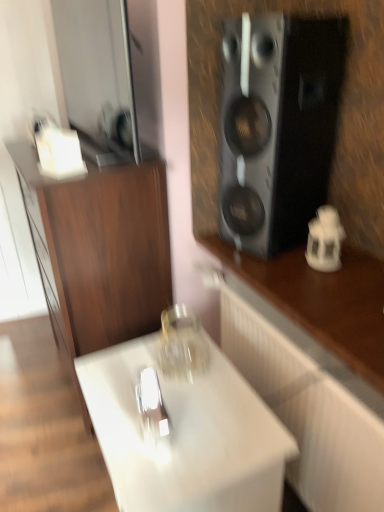
Question: Is the position of wooden cabinet at left, which is counted as the 2th cabinetry, starting from the right, more distant than that of white porcelain lantern at right?

Choices:
 (A) yes
 (B) no

Answer: (B)

Question: Are wooden cabinet at left, which appears as the 1th cabinetry when viewed from the left, and white porcelain lantern at right far apart?

Choices:
 (A) no
 (B) yes

Answer: (A)

Question: Does wooden cabinet at left, which is counted as the 2th cabinetry, starting from the right, appear on the right side of white porcelain lantern at right?

Choices:
 (A) no
 (B) yes

Answer: (A)

Question: From the image's perspective, is wooden cabinet at left, which is counted as the 2th cabinetry, starting from the right, below white porcelain lantern at right?

Choices:
 (A) no
 (B) yes

Answer: (B)

Question: Does wooden cabinet at left, which is counted as the 2th cabinetry, starting from the right, have a greater height compared to white porcelain lantern at right?

Choices:
 (A) yes
 (B) no

Answer: (A)

Question: Is wooden cabinet at left, which is counted as the 2th cabinetry, starting from the right, positioned beyond the bounds of white porcelain lantern at right?

Choices:
 (A) yes
 (B) no

Answer: (A)

Question: Can you confirm if white porcelain lantern at right is shorter than white glossy table at center?

Choices:
 (A) yes
 (B) no

Answer: (A)

Question: Is white porcelain lantern at right directly adjacent to white glossy table at center?

Choices:
 (A) no
 (B) yes

Answer: (A)

Question: Can you confirm if white porcelain lantern at right is smaller than white glossy table at center?

Choices:
 (A) no
 (B) yes

Answer: (B)

Question: Can you confirm if white porcelain lantern at right is bigger than white glossy table at center?

Choices:
 (A) no
 (B) yes

Answer: (A)

Question: Are white porcelain lantern at right and white glossy table at center located far from each other?

Choices:
 (A) yes
 (B) no

Answer: (B)

Question: Considering the relative positions of white porcelain lantern at right and white glossy table at center in the image provided, is white porcelain lantern at right in front of white glossy table at center?

Choices:
 (A) yes
 (B) no

Answer: (B)

Question: Is black matte speaker at upper right to the right of transparent glass jar at center from the viewer's perspective?

Choices:
 (A) no
 (B) yes

Answer: (B)